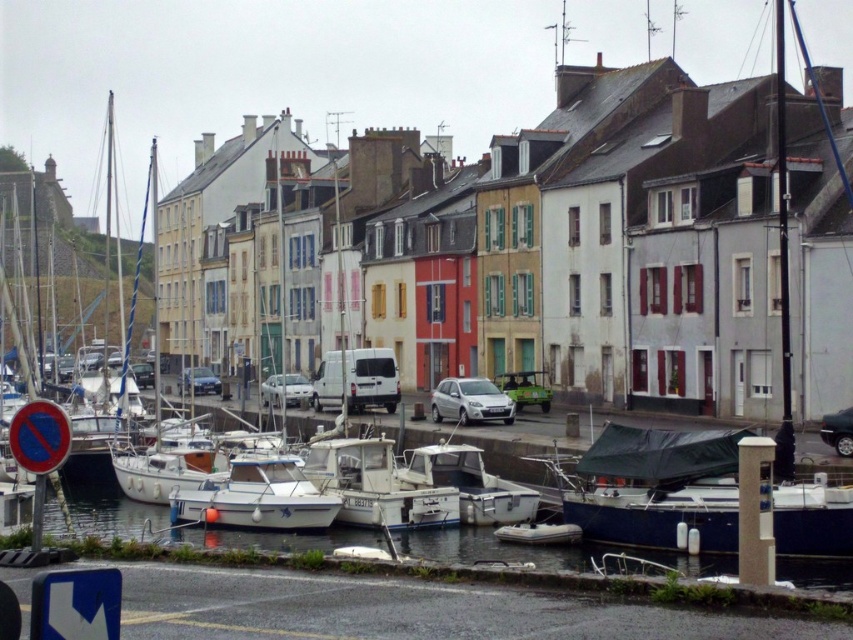
Who is taller, green matte car at center or matte white van at center?

green matte car at center is taller.

From the picture: Is green matte car at center in front of matte white van at center?

Yes.

Measure the distance between point (548, 404) and camera.

They are 92.58 meters apart.

I want to click on green matte car at center, so click(x=525, y=388).

Between shiny black sedan at center right and matte blue car at center, which one is positioned higher?

Positioned higher is matte blue car at center.

Between shiny black sedan at center right and matte blue car at center, which one appears on the right side from the viewer's perspective?

shiny black sedan at center right

The height and width of the screenshot is (640, 853). I want to click on shiny black sedan at center right, so click(838, 432).

Find the location of a particular element. shiny black sedan at center right is located at coordinates (838, 432).

Can you confirm if white matte boat at center is taller than shiny black sedan at center right?

Yes, white matte boat at center is taller than shiny black sedan at center right.

Which is behind, point (309, 509) or point (849, 413)?

Point (849, 413)

You are a GUI agent. You are given a task and a screenshot of the screen. Output one action in this format:
    pyautogui.click(x=<x>, y=<y>)
    Task: Click on the white matte boat at center
    
    Given the screenshot: What is the action you would take?
    pyautogui.click(x=256, y=497)